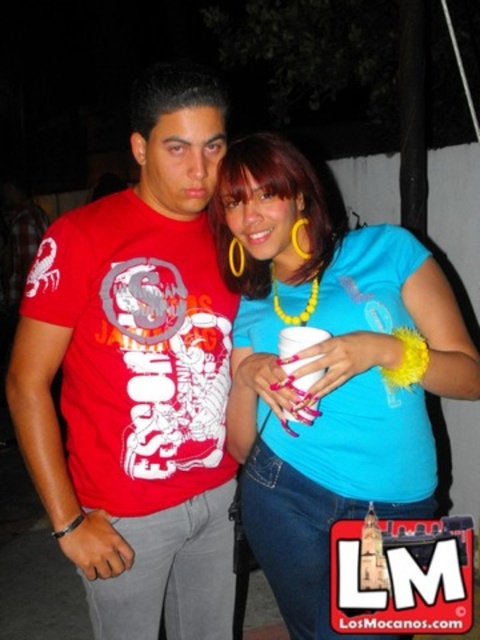
Question: Which point is farther to the camera?

Choices:
 (A) (344, 360)
 (B) (79, 268)

Answer: (B)

Question: Considering the relative positions of matte red t-shirt at left and blue fabric shirt at center in the image provided, where is matte red t-shirt at left located with respect to blue fabric shirt at center?

Choices:
 (A) left
 (B) right

Answer: (A)

Question: Which of the following is the farthest from the observer?

Choices:
 (A) matte red t-shirt at left
 (B) blue fabric shirt at center

Answer: (A)

Question: Does matte red t-shirt at left appear over blue fabric shirt at center?

Choices:
 (A) no
 (B) yes

Answer: (A)

Question: Which point is farther to the camera?

Choices:
 (A) blue fabric shirt at center
 (B) matte red t-shirt at left

Answer: (B)

Question: Is matte red t-shirt at left to the right of blue fabric shirt at center from the viewer's perspective?

Choices:
 (A) no
 (B) yes

Answer: (A)